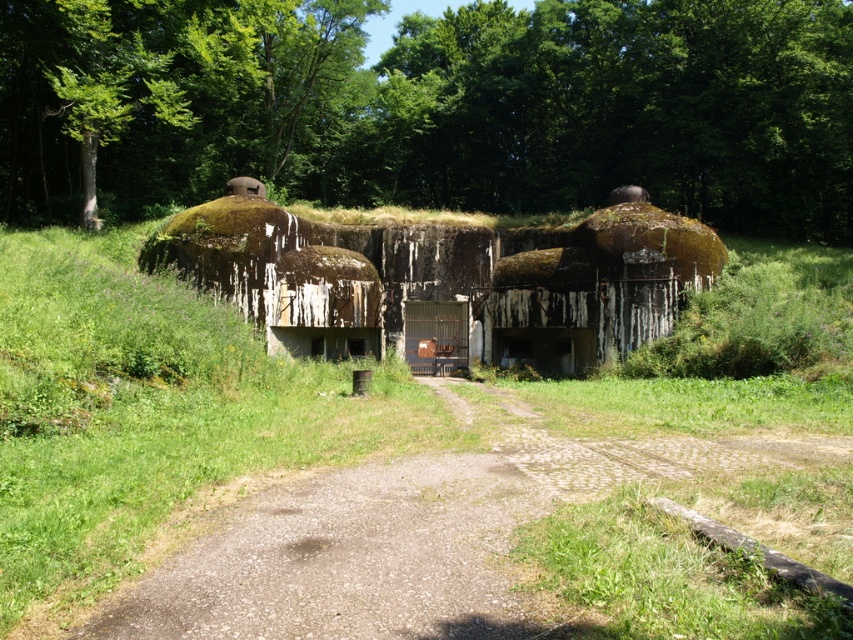
Is the position of dirt road at center less distant than that of green mossy dome at center?

That is True.

Consider the image. Can you confirm if dirt road at center is wider than green mossy dome at center?

No, dirt road at center is not wider than green mossy dome at center.

The width and height of the screenshot is (853, 640). Identify the location of dirt road at center. (503, 509).

Can you confirm if green leafy tree at upper center is positioned to the left of dirt road at center?

Indeed, green leafy tree at upper center is positioned on the left side of dirt road at center.

Is green leafy tree at upper center above dirt road at center?

Correct, green leafy tree at upper center is located above dirt road at center.

Consider the image. Measure the distance between point [28,131] and camera.

They are 47.02 meters apart.

You are a GUI agent. You are given a task and a screenshot of the screen. Output one action in this format:
    pyautogui.click(x=<x>, y=<y>)
    Task: Click on the green leafy tree at upper center
    
    Given the screenshot: What is the action you would take?
    pyautogui.click(x=432, y=108)

Can you confirm if green leafy tree at upper center is wider than green mossy dome at center?

Yes, green leafy tree at upper center is wider than green mossy dome at center.

Does green leafy tree at upper center have a larger size compared to green mossy dome at center?

Yes.

Which is behind, point (45, 67) or point (213, 200)?

The point (213, 200) is behind.

This screenshot has height=640, width=853. Identify the location of green leafy tree at upper center. (432, 108).